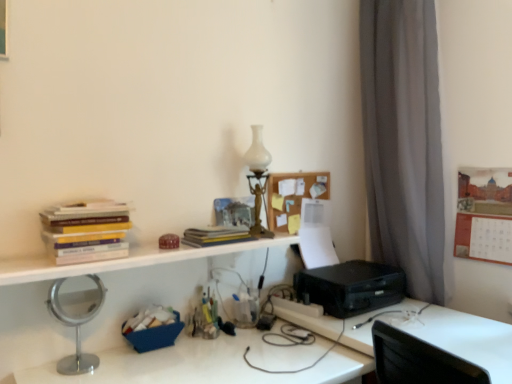
Locate an element on the screen. The width and height of the screenshot is (512, 384). vacant area that lies to the right of matte brown box at center, marked as the first stationery in a top-to-bottom arrangement is located at coordinates (202, 250).